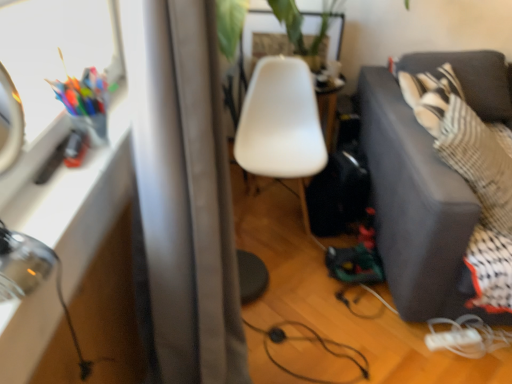
Question: Is clear glass table at left to the left of white plastic chair at center from the viewer's perspective?

Choices:
 (A) yes
 (B) no

Answer: (A)

Question: From the image's perspective, is clear glass table at left over white plastic chair at center?

Choices:
 (A) no
 (B) yes

Answer: (A)

Question: Considering the relative sizes of clear glass table at left and white plastic chair at center in the image provided, is clear glass table at left wider than white plastic chair at center?

Choices:
 (A) no
 (B) yes

Answer: (A)

Question: Is clear glass table at left positioned beyond the bounds of white plastic chair at center?

Choices:
 (A) no
 (B) yes

Answer: (B)

Question: Can you confirm if clear glass table at left is taller than white plastic chair at center?

Choices:
 (A) no
 (B) yes

Answer: (A)

Question: Is clear glass table at left thinner than white plastic chair at center?

Choices:
 (A) yes
 (B) no

Answer: (A)

Question: Considering the relative sizes of dark gray fabric couch at right and white matte extension cord at lower right in the image provided, is dark gray fabric couch at right taller than white matte extension cord at lower right?

Choices:
 (A) yes
 (B) no

Answer: (A)

Question: Does dark gray fabric couch at right contain white matte extension cord at lower right?

Choices:
 (A) yes
 (B) no

Answer: (A)

Question: Is dark gray fabric couch at right turned away from white matte extension cord at lower right?

Choices:
 (A) yes
 (B) no

Answer: (B)

Question: From a real-world perspective, is dark gray fabric couch at right physically below white matte extension cord at lower right?

Choices:
 (A) yes
 (B) no

Answer: (B)

Question: Is dark gray fabric couch at right beside white matte extension cord at lower right?

Choices:
 (A) yes
 (B) no

Answer: (B)

Question: Does dark gray fabric couch at right have a smaller size compared to white matte extension cord at lower right?

Choices:
 (A) yes
 (B) no

Answer: (B)

Question: Does white matte extension cord at lower right appear on the left side of clear glass table at left?

Choices:
 (A) no
 (B) yes

Answer: (A)